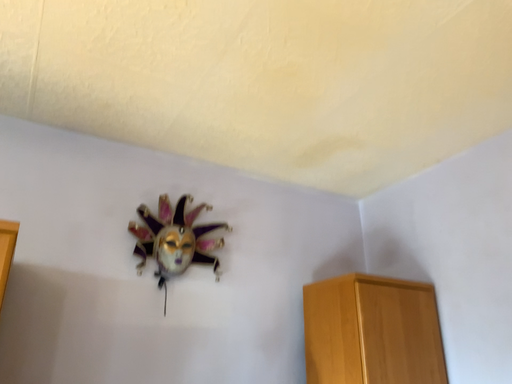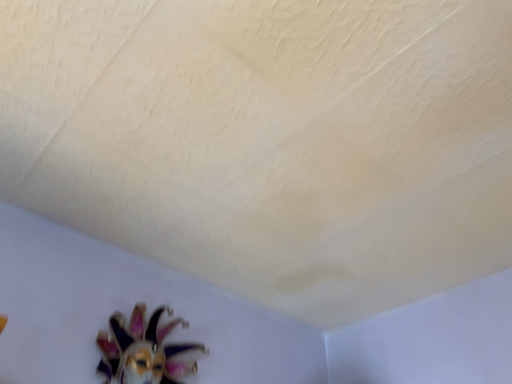
Question: Which way did the camera rotate in the video?

Choices:
 (A) rotated left
 (B) rotated right

Answer: (B)